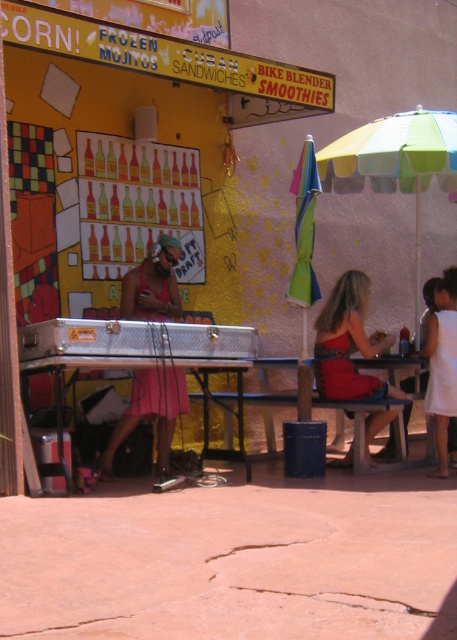
Question: Does multicolored striped umbrella at right appear on the right side of wooden table at lower center?

Choices:
 (A) no
 (B) yes

Answer: (B)

Question: Does multicolored striped umbrella at right have a larger size compared to matte red dress at lower right?

Choices:
 (A) yes
 (B) no

Answer: (A)

Question: Which point is farther to the camera?

Choices:
 (A) pos(435,140)
 (B) pos(329,355)
 (C) pos(382,358)

Answer: (C)

Question: Estimate the real-world distances between objects in this image. Which object is closer to the white cotton dress at lower right?

Choices:
 (A) metallic silver table at center
 (B) matte red dress at lower right
 (C) wooden table at lower center

Answer: (C)

Question: Does white cotton dress at lower right have a larger size compared to wooden table at lower center?

Choices:
 (A) yes
 (B) no

Answer: (A)

Question: Among these points, which one is farthest from the camera?

Choices:
 (A) (180, 368)
 (B) (347, 173)
 (C) (255, 337)
 (D) (444, 346)

Answer: (B)